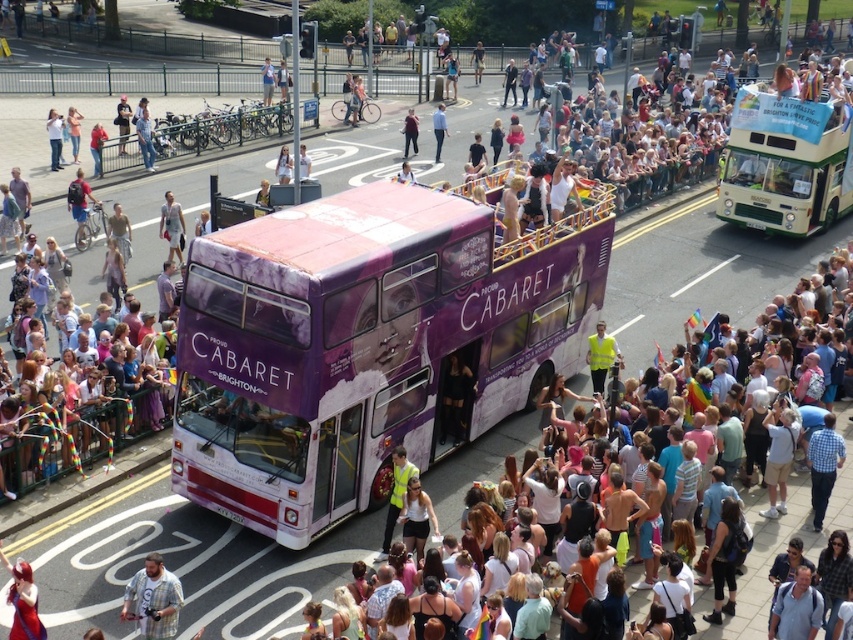
Between point (780, 176) and point (167, 576), which one is positioned in front?

Point (167, 576) is in front.

Who is higher up, green metallic bus at upper right or plaid shirt at lower left?

green metallic bus at upper right

Is point (764, 99) more distant than point (154, 580)?

Yes, it is behind point (154, 580).

Locate an element on the screen. green metallic bus at upper right is located at coordinates (784, 163).

Can you confirm if purple matte/decorative bus at center is positioned to the right of plaid shirt at lower left?

Indeed, purple matte/decorative bus at center is positioned on the right side of plaid shirt at lower left.

Who is taller, purple matte/decorative bus at center or plaid shirt at lower left?

Standing taller between the two is purple matte/decorative bus at center.

This screenshot has height=640, width=853. I want to click on purple matte/decorative bus at center, so click(364, 346).

Can you confirm if purple matte/decorative bus at center is taller than green metallic bus at upper right?

Yes.

Consider the image. Which is below, purple matte/decorative bus at center or green metallic bus at upper right?

purple matte/decorative bus at center

Which is in front, point (326, 241) or point (827, 209)?

Point (326, 241)

In order to click on purple matte/decorative bus at center in this screenshot , I will do `click(364, 346)`.